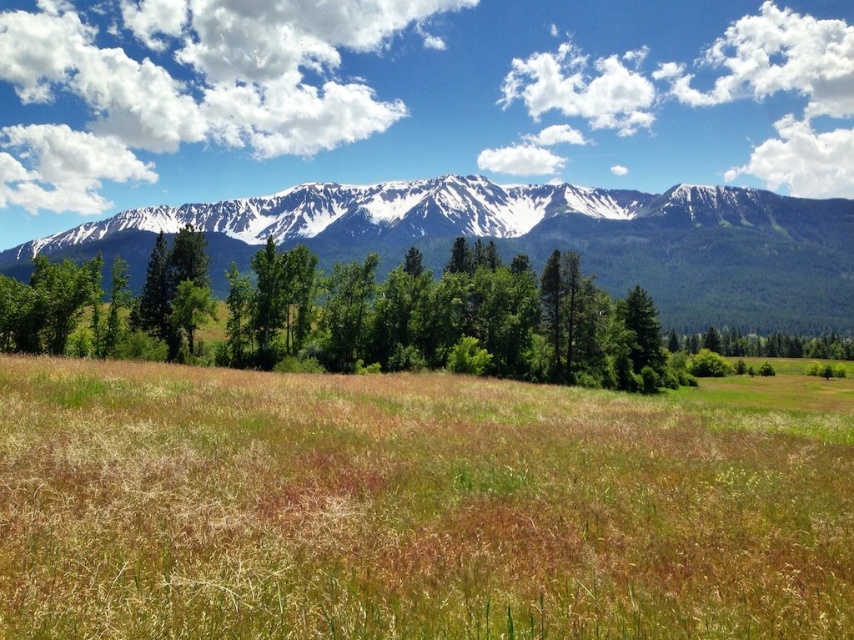
Question: Which of the following is the farthest from the observer?

Choices:
 (A) (x=123, y=540)
 (B) (x=788, y=324)

Answer: (B)

Question: Is brown grassland at center bigger than snowy granite mountain range at upper center?

Choices:
 (A) no
 (B) yes

Answer: (A)

Question: Which point is farther to the camera?

Choices:
 (A) brown grassland at center
 (B) snowy granite mountain range at upper center

Answer: (B)

Question: Which point is closer to the camera taking this photo?

Choices:
 (A) (819, 310)
 (B) (642, 444)

Answer: (B)

Question: Can you confirm if brown grassland at center is positioned to the right of snowy granite mountain range at upper center?

Choices:
 (A) yes
 (B) no

Answer: (A)

Question: Does brown grassland at center lie in front of snowy granite mountain range at upper center?

Choices:
 (A) yes
 (B) no

Answer: (A)